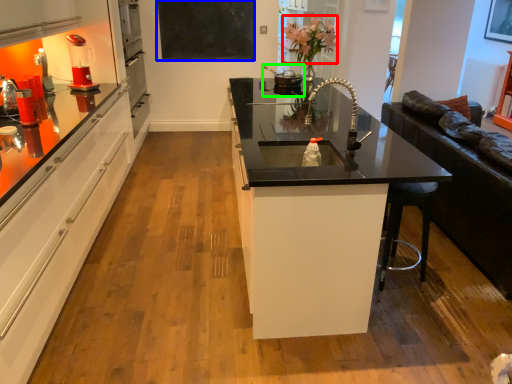
Question: Estimate the real-world distances between objects in this image. Which object is closer to flower (highlighted by a red box), bulletin board (highlighted by a blue box) or appliance (highlighted by a green box)?

Choices:
 (A) bulletin board
 (B) appliance

Answer: (B)